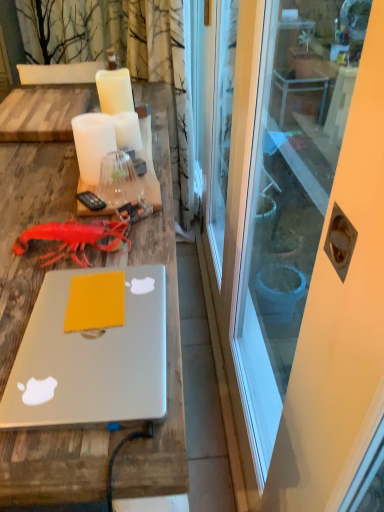
What are the coordinates of `vacant space in front of yellow matte notepad at center` in the screenshot? It's located at (83, 365).